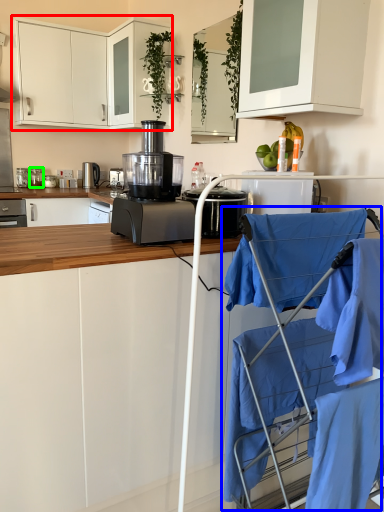
Question: Which object is the closest to the cabinetry (highlighted by a red box)? Choose among these: baby carriage (highlighted by a blue box) or kitchen appliance (highlighted by a green box).

Choices:
 (A) baby carriage
 (B) kitchen appliance

Answer: (B)